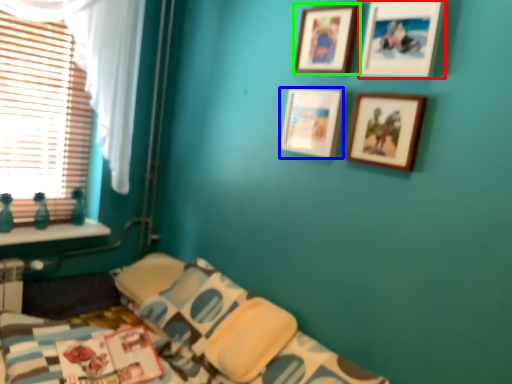
Question: Estimate the real-world distances between objects in this image. Which object is farther from picture frame (highlighted by a red box), picture frame (highlighted by a blue box) or picture frame (highlighted by a green box)?

Choices:
 (A) picture frame
 (B) picture frame

Answer: (A)